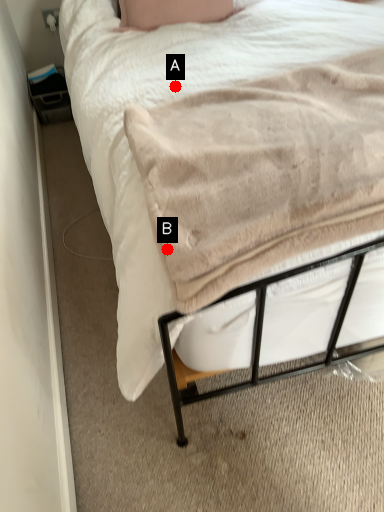
Question: Two points are circled on the image, labeled by A and B beside each circle. Which point is further to the camera?

Choices:
 (A) A is further
 (B) B is further

Answer: (A)